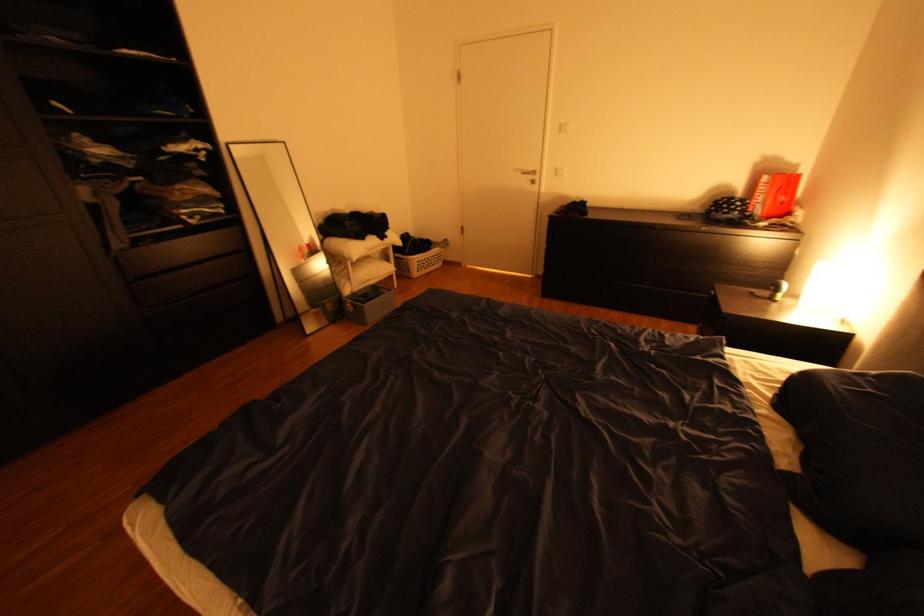
Locate an element on the screen. silver door handle is located at coordinates (529, 174).